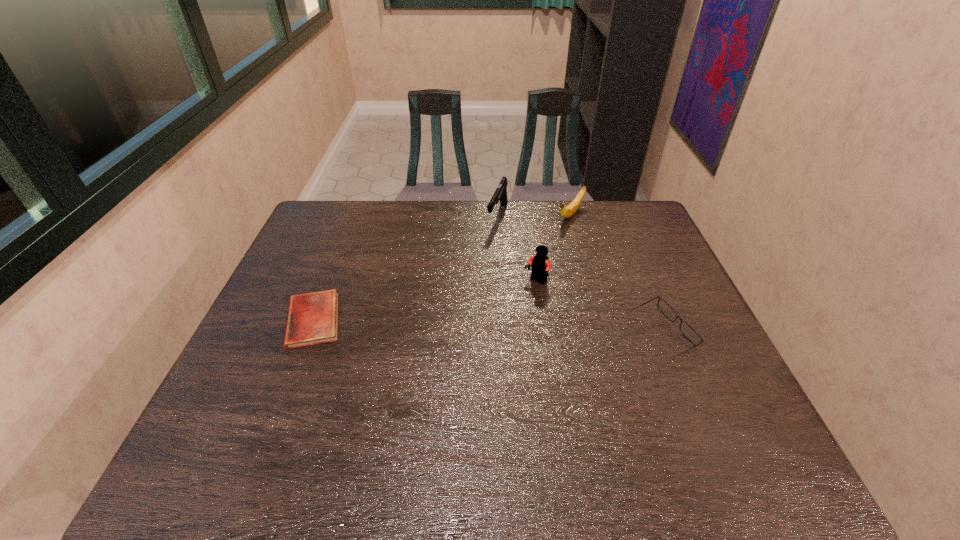
Where is `free space on the desktop that is between the shortest object and the spectacles and is positioned on the front-facing side of the third nearest object`? This screenshot has width=960, height=540. free space on the desktop that is between the shortest object and the spectacles and is positioned on the front-facing side of the third nearest object is located at coordinates (489, 328).

The width and height of the screenshot is (960, 540). In order to click on vacant spot on the desktop that is between the diary and the rightmost object and is positioned at the aiming end of the second object from left to right in this screenshot , I will do `click(444, 326)`.

I want to click on free space on the desktop that is between the leftmost object and the spectacles and is positioned at the stem of the third tallest object, so click(x=453, y=326).